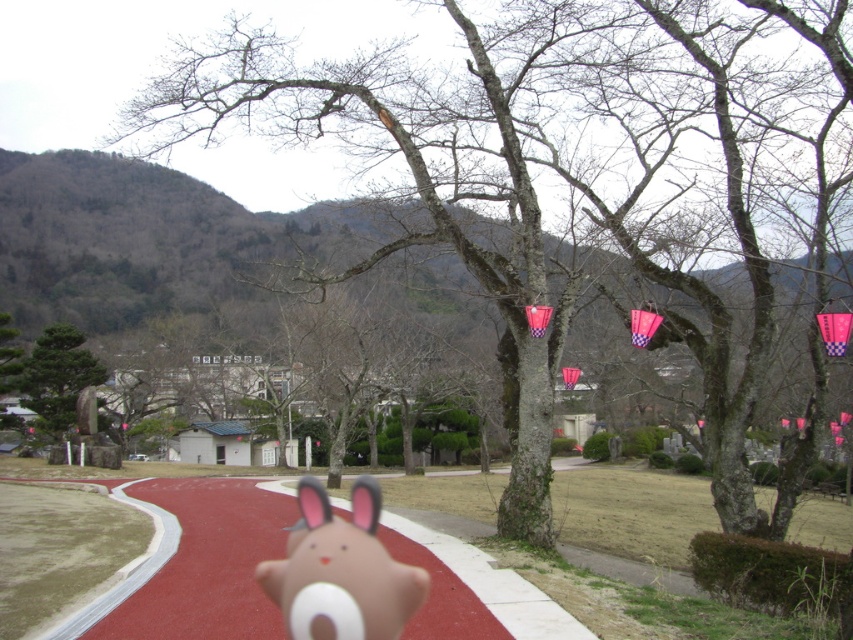
You are standing at the starting point of the red pathway and want to reach the first point. Which point should you head towards, point (230, 500) or point (358, 634)?

You should head towards point (358, 634) because point (230, 500) is behind point (358, 634), meaning the latter is closer to your starting position on the red pathway.

You are a photographer standing at the starting point of the red pathway. You want to take a photo of the white matte plush toy at center so that it appears centered in your camera frame. Based on the scene description, where should you position yourself along the red pathway to ensure the toy is perfectly centered in your shot?

To center the white matte plush toy at center in your photo, you should position yourself directly along the red pathway at the point corresponding to its 2D coordinates, which is at location 0.892 on the x axis and 0.401 on the y axis.